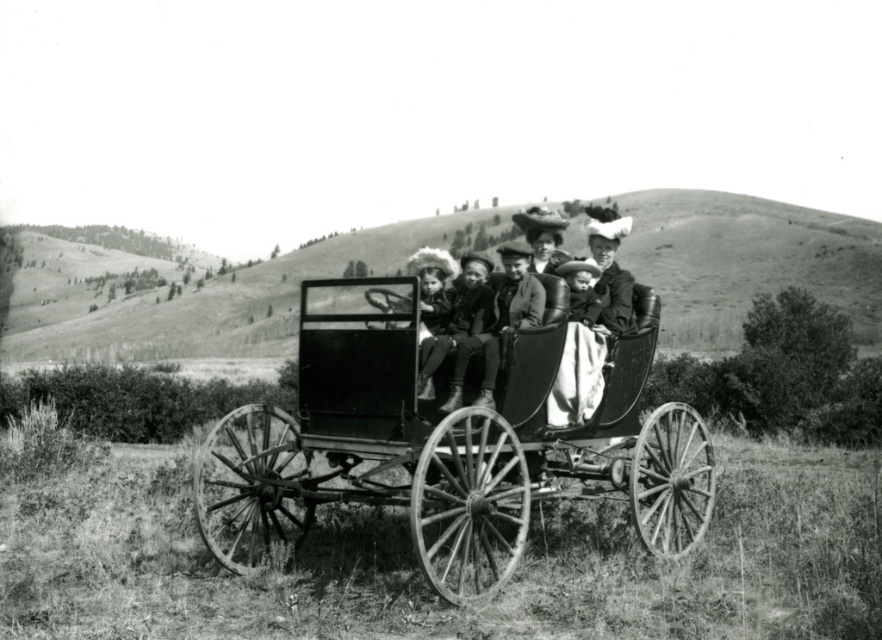
You are standing at the origin point in the image and want to move towards the matte black carriage at center. According to the coordinates provided, in which direction should you head?

The matte black carriage at center is located at coordinates point (542, 236), so you should move towards the right and upward from your current position at the origin to reach it.

You are a photographer who needs to capture a closeup shot of both the wooden wagon at center and the smooth fabric baby at center. Given that your camera can only focus on objects within a 5 feet range, will you be able to capture both subjects in one shot?

The wooden wagon at center and the smooth fabric baby at center are 5.89 feet apart from each other. Since the distance between them exceeds the camera focus range of 5 feet, you cannot capture both subjects in one shot.

In the scene shown: You are standing in front of the vintage scene and want to take a closer look at the wooden wagon at center and the matte black carriage at center. Which one appears nearer to you?

The wooden wagon at center appears nearer to you because it is closer to the viewer than the matte black carriage at center.